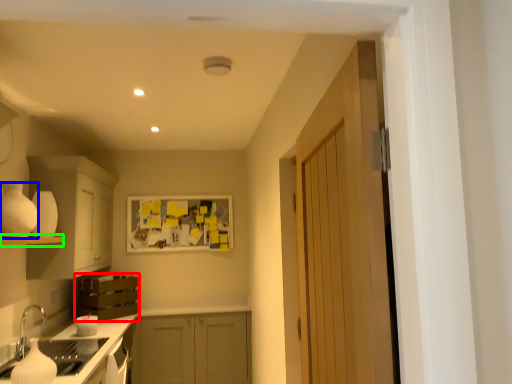
Question: Which object is positioned closest to cabinetry (highlighted by a red box)? Select from appliance (highlighted by a blue box) and shelf (highlighted by a green box).

Choices:
 (A) appliance
 (B) shelf

Answer: (B)